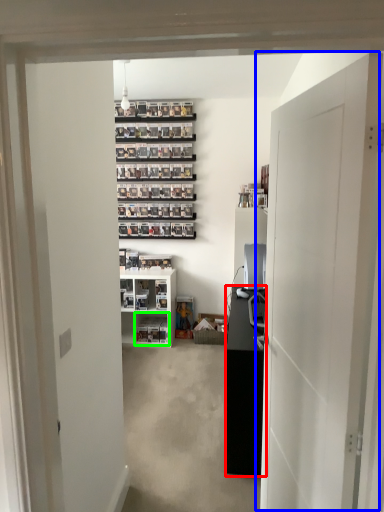
Question: Based on their relative distances, which object is farther from cabinetry (highlighted by a red box)? Choose from door (highlighted by a blue box) and shelf (highlighted by a green box).

Choices:
 (A) door
 (B) shelf

Answer: (B)